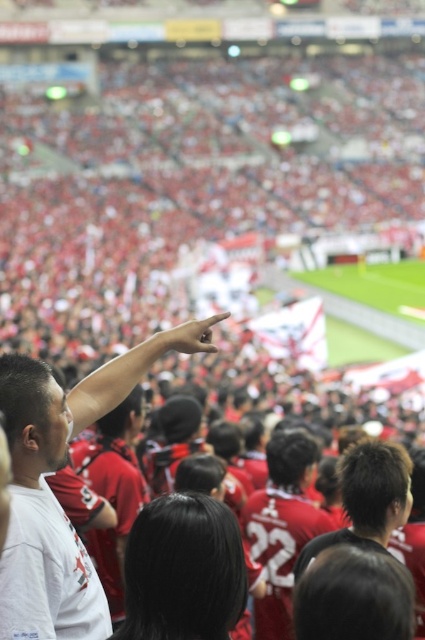
Can you confirm if white matte shirt at upper left is positioned above dark brown hair at center?

Yes, white matte shirt at upper left is above dark brown hair at center.

Who is positioned more to the right, white matte shirt at upper left or dark brown hair at center?

dark brown hair at center

Is point (42, 467) positioned behind point (337, 470)?

No.

You are a GUI agent. You are given a task and a screenshot of the screen. Output one action in this format:
    pyautogui.click(x=<x>, y=<y>)
    Task: Click on the white matte shirt at upper left
    The image size is (425, 640).
    Given the screenshot: What is the action you would take?
    pyautogui.click(x=42, y=518)

Does point (31, 563) lie in front of point (62, 556)?

Yes, it is in front of point (62, 556).

This screenshot has width=425, height=640. What do you see at coordinates (53, 493) in the screenshot?
I see `red jersey at left` at bounding box center [53, 493].

Who is more forward, (48, 376) or (40, 394)?

Positioned in front is point (40, 394).

You are a GUI agent. You are given a task and a screenshot of the screen. Output one action in this format:
    pyautogui.click(x=<x>, y=<y>)
    Task: Click on the red jersey at left
    The height and width of the screenshot is (640, 425).
    Given the screenshot: What is the action you would take?
    pyautogui.click(x=53, y=493)

Does red jersey at left have a smaller size compared to dark brown hair at center?

No, red jersey at left is not smaller than dark brown hair at center.

Does red jersey at left have a lesser width compared to dark brown hair at center?

Incorrect, red jersey at left's width is not less than dark brown hair at center's.

At what (x,y) coordinates should I click in order to perform the action: click on red jersey at left. Please return your answer as a coordinate pair (x, y). The image size is (425, 640). Looking at the image, I should click on (53, 493).

I want to click on red jersey at left, so click(x=53, y=493).